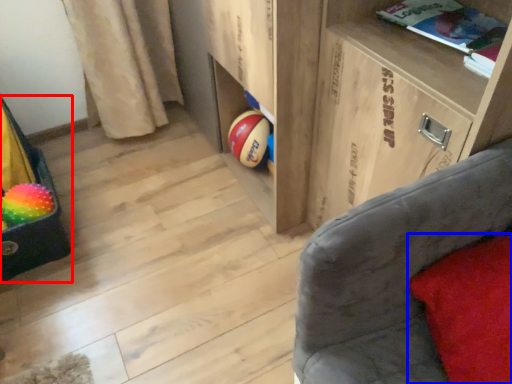
Question: Which object appears farthest to the camera in this image, bean bag chair (highlighted by a red box) or pillow (highlighted by a blue box)?

Choices:
 (A) bean bag chair
 (B) pillow

Answer: (A)